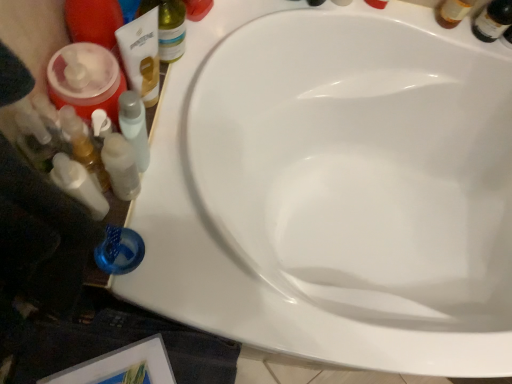
Question: Can you confirm if white plastic bottles at left is smaller than translucent plastic bottle at upper left?

Choices:
 (A) yes
 (B) no

Answer: (A)

Question: Does white plastic bottles at left appear on the left side of translucent plastic bottle at upper left?

Choices:
 (A) yes
 (B) no

Answer: (A)

Question: From a real-world perspective, is white plastic bottles at left on top of translucent plastic bottle at upper left?

Choices:
 (A) no
 (B) yes

Answer: (A)

Question: Is white plastic bottles at left further to camera compared to translucent plastic bottle at upper left?

Choices:
 (A) no
 (B) yes

Answer: (A)

Question: Is translucent plastic bottle at upper left surrounded by white plastic bottles at left?

Choices:
 (A) yes
 (B) no

Answer: (B)

Question: From the image's perspective, relative to translucent plastic bottle at upper left, is white plastic bottles at left above or below?

Choices:
 (A) above
 (B) below

Answer: (B)

Question: Considering the positions of white plastic bottles at left and translucent plastic bottle at upper left in the image, is white plastic bottles at left wider or thinner than translucent plastic bottle at upper left?

Choices:
 (A) wide
 (B) thin

Answer: (B)

Question: Relative to translucent plastic bottle at upper left, is white plastic bottles at left in front or behind?

Choices:
 (A) behind
 (B) front

Answer: (B)

Question: In terms of height, does white plastic bottles at left look taller or shorter compared to translucent plastic bottle at upper left?

Choices:
 (A) short
 (B) tall

Answer: (A)

Question: Is translucent plastic bottle at upper left spatially inside white plastic bottles at left, or outside of it?

Choices:
 (A) outside
 (B) inside

Answer: (A)

Question: Considering the positions of translucent plastic bottle at upper left and white plastic bottles at left in the image, is translucent plastic bottle at upper left wider or thinner than white plastic bottles at left?

Choices:
 (A) wide
 (B) thin

Answer: (A)

Question: From the image's perspective, relative to white plastic bottles at left, is translucent plastic bottle at upper left above or below?

Choices:
 (A) below
 (B) above

Answer: (B)

Question: From a real-world perspective, is translucent plastic bottle at upper left physically located above or below white plastic bottles at left?

Choices:
 (A) above
 (B) below

Answer: (A)

Question: Is translucent glass beer bottle at upper right in front of or behind white plastic bottles at left in the image?

Choices:
 (A) front
 (B) behind

Answer: (B)

Question: Considering the positions of translucent glass beer bottle at upper right and white plastic bottles at left in the image, is translucent glass beer bottle at upper right wider or thinner than white plastic bottles at left?

Choices:
 (A) wide
 (B) thin

Answer: (B)